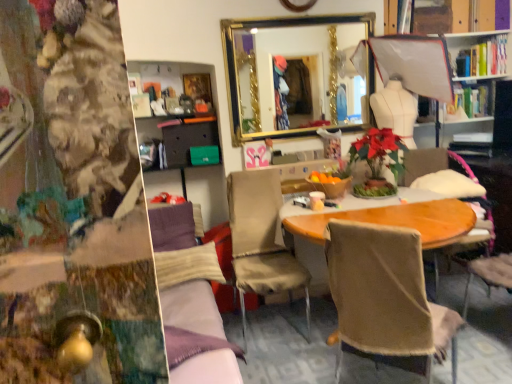
Question: Can you confirm if matte gray drawer at center-left is shorter than hardcover books at upper right?

Choices:
 (A) no
 (B) yes

Answer: (B)

Question: From the image's perspective, is matte gray drawer at center-left located above hardcover books at upper right?

Choices:
 (A) yes
 (B) no

Answer: (B)

Question: Can you confirm if matte gray drawer at center-left is thinner than hardcover books at upper right?

Choices:
 (A) yes
 (B) no

Answer: (A)

Question: Is matte gray drawer at center-left looking in the opposite direction of hardcover books at upper right?

Choices:
 (A) yes
 (B) no

Answer: (B)

Question: Is matte gray drawer at center-left closer to the viewer compared to hardcover books at upper right?

Choices:
 (A) no
 (B) yes

Answer: (B)

Question: In the image, is velvet purple couch at center positioned in front of or behind gold-framed mirror at upper center?

Choices:
 (A) front
 (B) behind

Answer: (A)

Question: In terms of width, does velvet purple couch at center look wider or thinner when compared to gold-framed mirror at upper center?

Choices:
 (A) wide
 (B) thin

Answer: (A)

Question: Is velvet purple couch at center to the left or to the right of gold-framed mirror at upper center in the image?

Choices:
 (A) right
 (B) left

Answer: (B)

Question: Is point (173, 276) positioned closer to the camera than point (304, 44)?

Choices:
 (A) farther
 (B) closer

Answer: (B)

Question: From a real-world perspective, is hardcover books at upper right physically located above or below gold-framed mirror at upper center?

Choices:
 (A) above
 (B) below

Answer: (A)

Question: Is point (494, 51) closer or farther from the camera than point (256, 132)?

Choices:
 (A) closer
 (B) farther

Answer: (B)

Question: Is hardcover books at upper right to the left or to the right of gold-framed mirror at upper center in the image?

Choices:
 (A) right
 (B) left

Answer: (A)

Question: Is hardcover books at upper right spatially inside gold-framed mirror at upper center, or outside of it?

Choices:
 (A) outside
 (B) inside

Answer: (A)

Question: In terms of width, does beige fabric chair at center, which is the third chair in right-to-left order, look wider or thinner when compared to wooden chair at center, marked as the 1th chair in a right-to-left arrangement?

Choices:
 (A) wide
 (B) thin

Answer: (B)

Question: In the image, is beige fabric chair at center, which is the third chair in right-to-left order, on the left side or the right side of wooden chair at center, marked as the 1th chair in a right-to-left arrangement?

Choices:
 (A) right
 (B) left

Answer: (B)